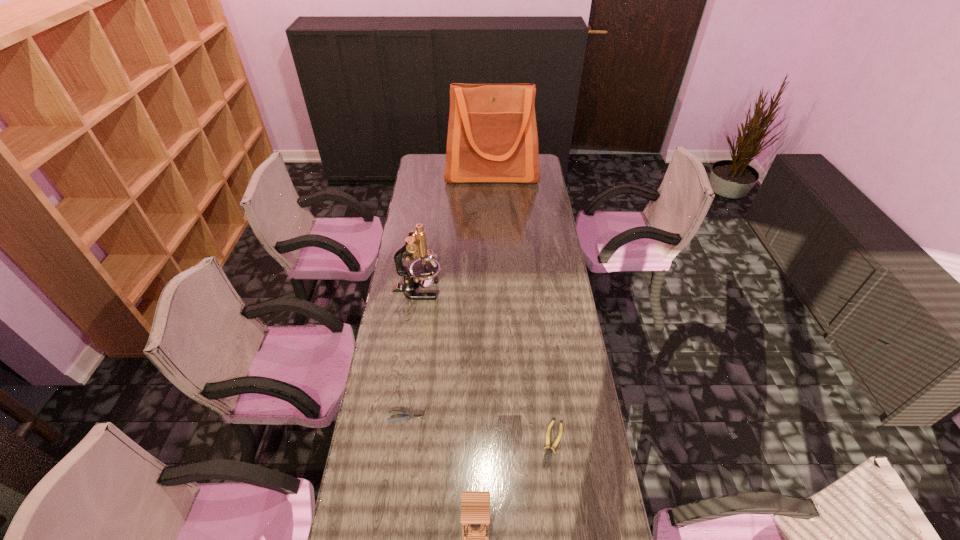
Locate an element on the screen. Image resolution: width=960 pixels, height=540 pixels. free region that satisfies the following two spatial constraints: 1. at the eyepiece of the right pliers; 2. on the left side of the fourth shortest object is located at coordinates (396, 444).

The height and width of the screenshot is (540, 960). In order to click on vacant point that satisfies the following two spatial constraints: 1. on the back side of the right pliers; 2. at the eyepiece of the second tallest object in this screenshot , I will do `click(534, 290)`.